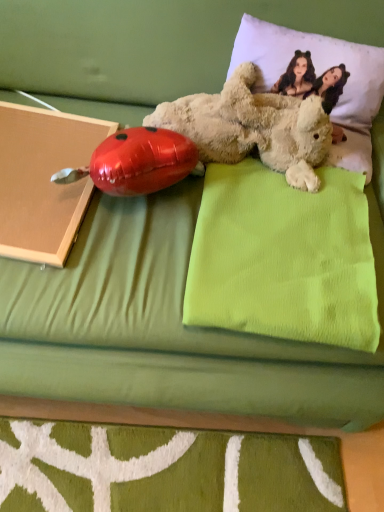
The width and height of the screenshot is (384, 512). I want to click on free point above matte cardboard book at left (from a real-world perspective), so click(x=39, y=135).